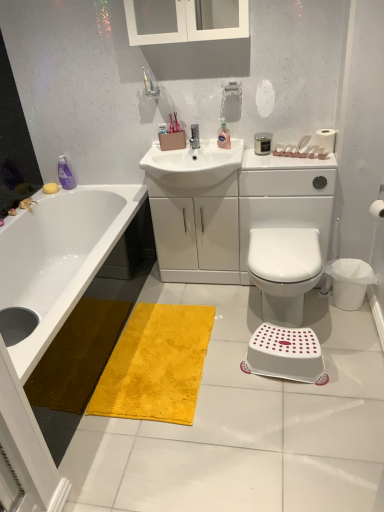
At what (x,y) coordinates should I click in order to perform the action: click on vacant space to the right of matte silver faucet at center. Please return your answer as a coordinate pair (x, y). Looking at the image, I should click on (228, 147).